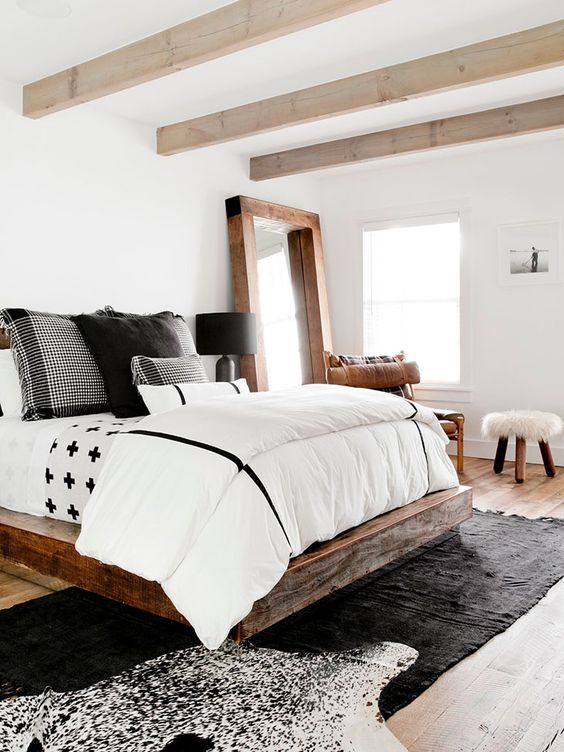
Where is `brown floor`? The width and height of the screenshot is (564, 752). brown floor is located at coordinates (543, 714).